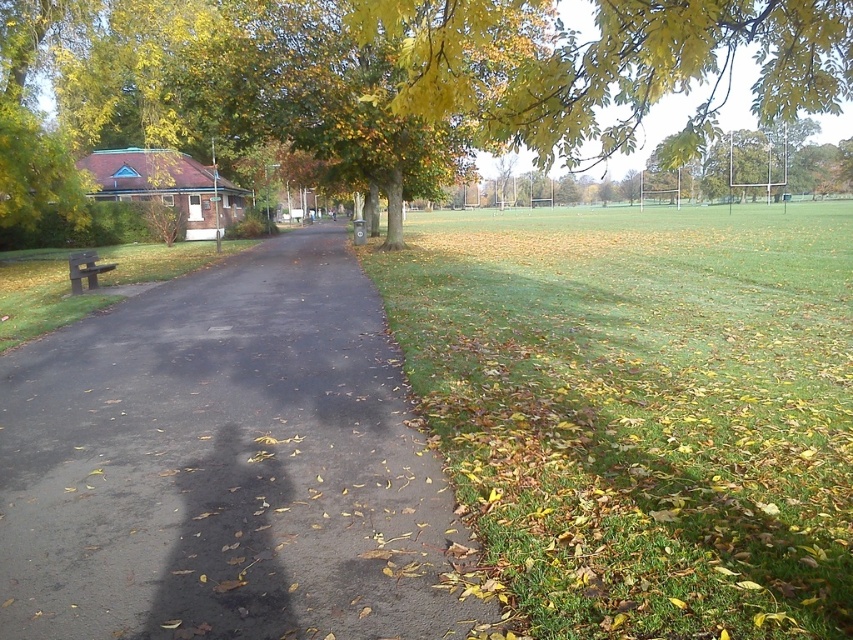
You are planning to place a picnic blanket on the green grass at right and the metallic park bench at left. Which location would allow you to spread the blanket more comfortably?

The green grass at right has a larger size compared to the metallic park bench at left, so you can spread the picnic blanket more comfortably there.

You are a gardener who needs to mow the lawn. You see the green grass at right and the metallic park bench at left. Which area should you avoid mowing to prevent damaging the bench?

You should avoid mowing near the metallic park bench at left because the green grass at right is taller than the metallic park bench at left, meaning the bench itself is not tall enough to be in danger from the mower. However, the grass at the right is taller and needs mowing, so focus on that area while keeping the mower away from the bench to prevent any accidental contact.

You are standing at the point with coordinates point [372,67] and want to walk to the point with coordinates point [749,460]. Which direction should you move to reach your destination?

You should move forward because point [749,460] is in front of point [372,67].